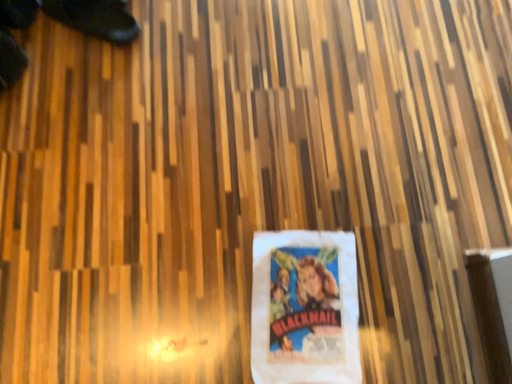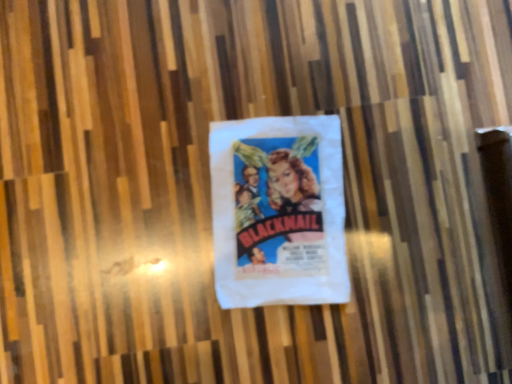
Question: How did the camera likely rotate when shooting the video?

Choices:
 (A) rotated downward
 (B) rotated upward

Answer: (A)